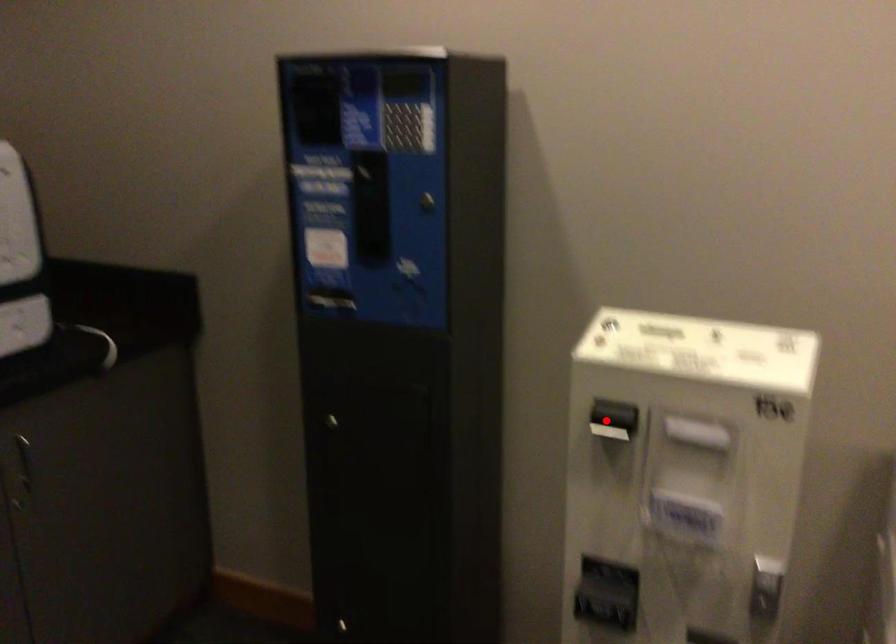
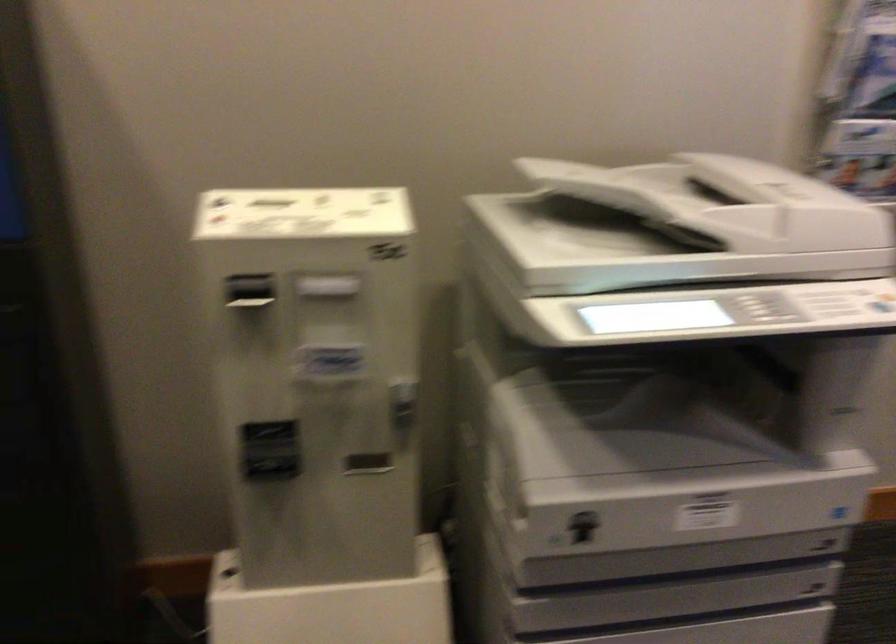
Question: I am providing you with two images of the same scene from different viewpoints. A red point is marked on the first image. Can you still see the location of the red point in image 2?

Choices:
 (A) Yes
 (B) No

Answer: (A)